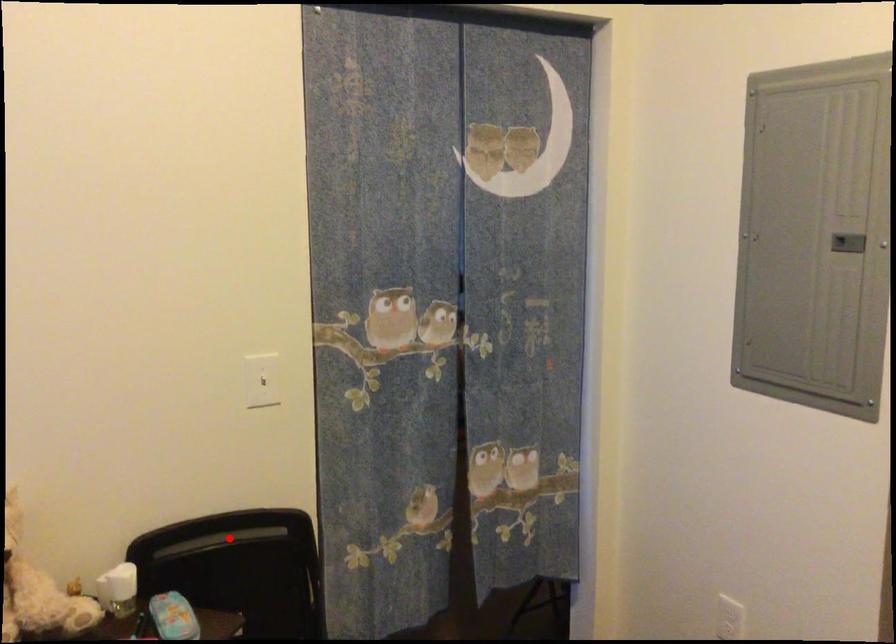
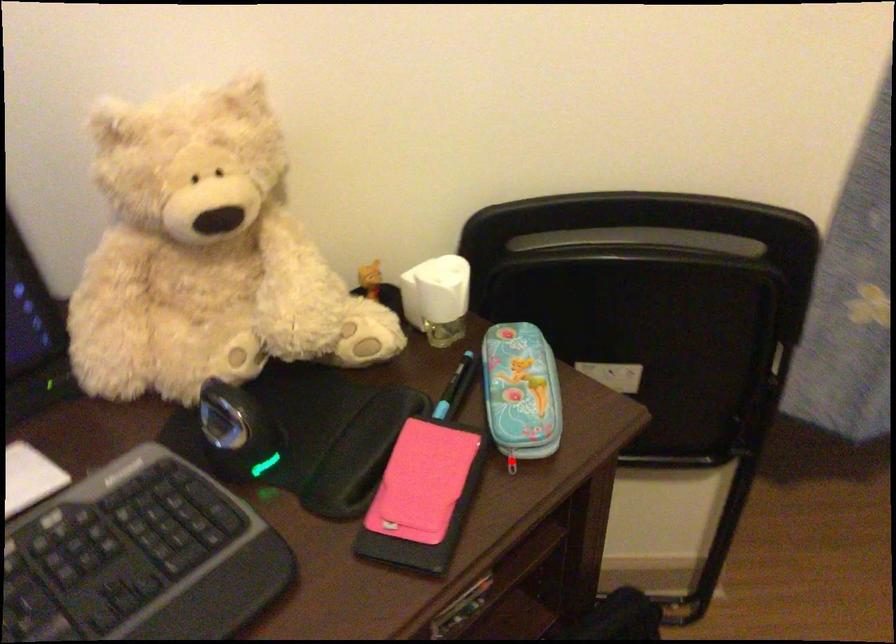
I am providing you with two images of the same scene from different viewpoints. A red point is marked on the first image and another point is marked on the second image. Does the point marked in image1 correspond to the same location as the one in image2?

No